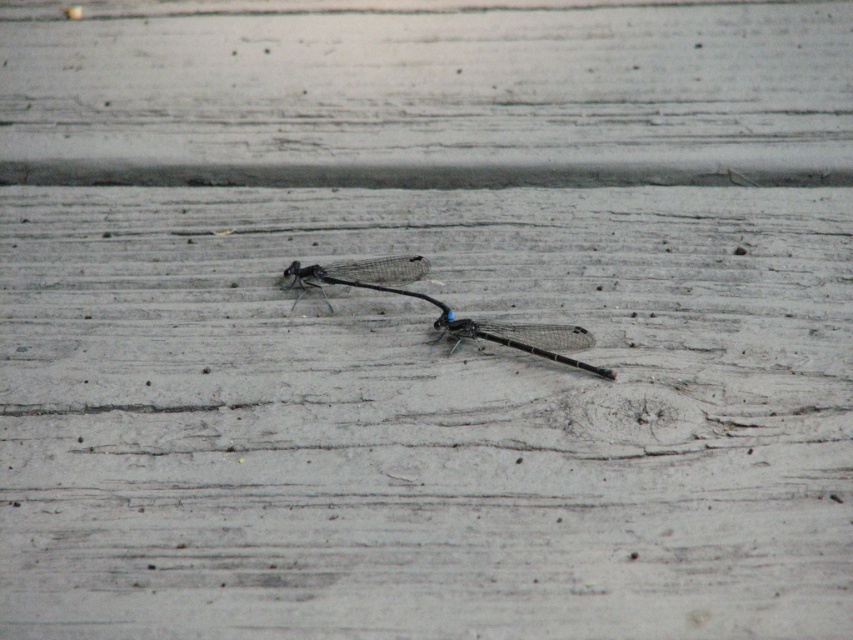
You are an entomologist examining two dragonflies on a wooden surface. You need to determine which one is taller. You have the matte black dragonfly at center and the transparent glass dragonfly at center in your view. Which dragonfly is taller?

The matte black dragonfly at center is taller than the transparent glass dragonfly at center.

You are an entomologist examining two dragonflies on a wooden surface. You have a ruler with you. Which dragonfly, the matte black dragonfly at center or the transparent glass dragonfly at center, will you need to measure first to determine which is larger?

The matte black dragonfly at center is bigger than the transparent glass dragonfly at center, so you should measure the matte black dragonfly at center first to confirm its larger size.

You are an entomologist examining two dragonflies on a wooden surface. You notice a matte black dragonfly at center and a transparent glass dragonfly at center. Which one is positioned to the right of the other?

The matte black dragonfly at center is to the right of the transparent glass dragonfly at center.